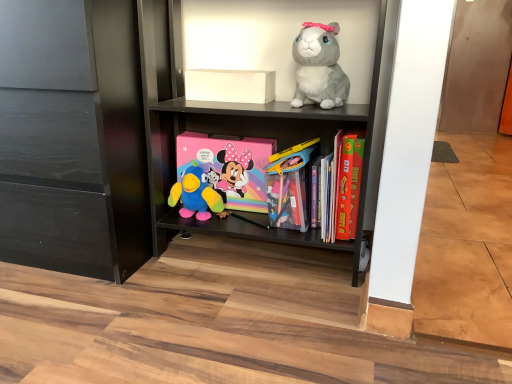
In order to click on free spot in front of matte black shelf at center in this screenshot , I will do `click(239, 344)`.